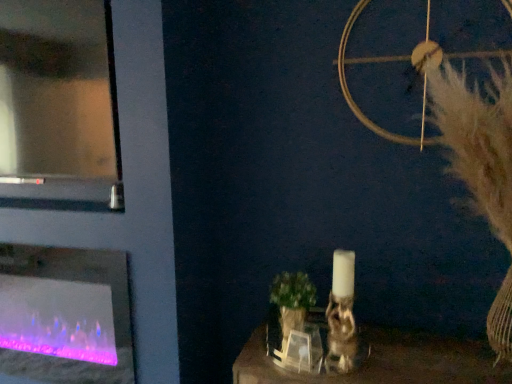
Where is `blank area beneath transparent glass door at upper left (from a real-world perspective)`? The height and width of the screenshot is (384, 512). blank area beneath transparent glass door at upper left (from a real-world perspective) is located at coordinates (49, 196).